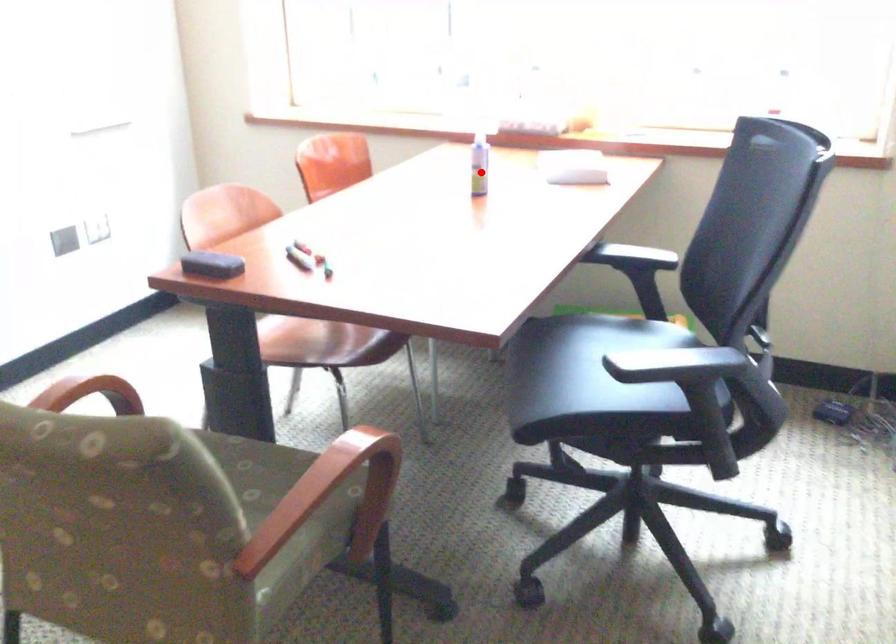
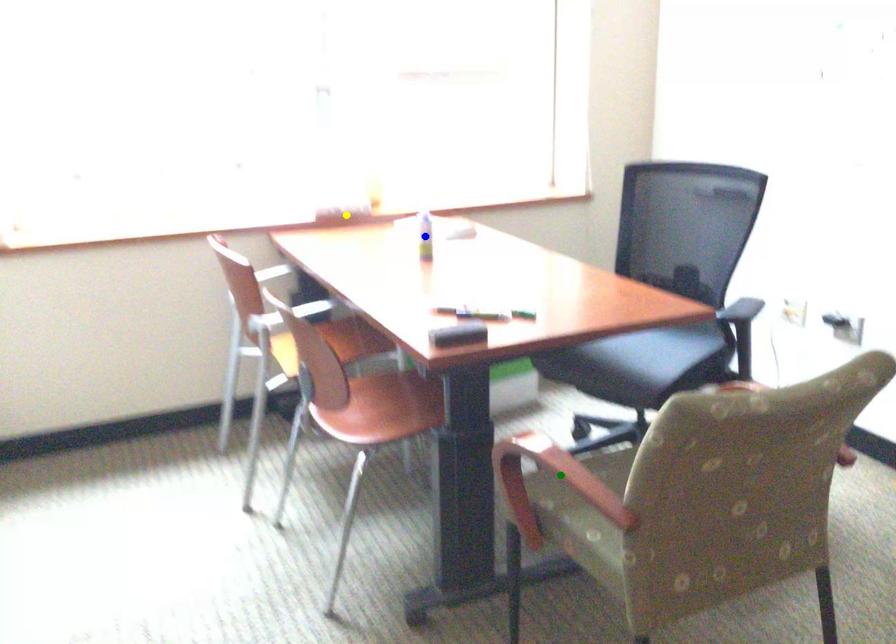
Question: I am providing you with two images of the same scene from different viewpoints. A red point is marked on the first image. You are given multiple points on the second image. Which point in image 2 is actually the same real-world point as the red point in image 1?

Choices:
 (A) green point
 (B) yellow point
 (C) blue point

Answer: (C)